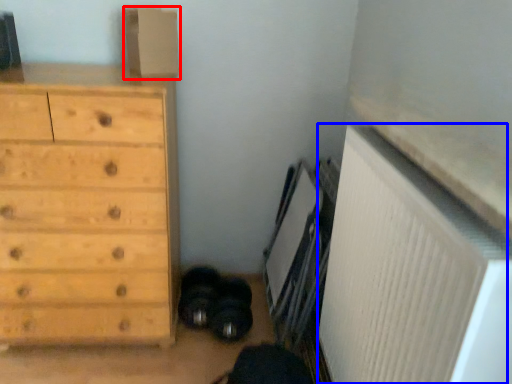
Question: Which of the following is the closest to the observer, cardboard box (highlighted by a red box) or radiator (highlighted by a blue box)?

Choices:
 (A) cardboard box
 (B) radiator

Answer: (B)